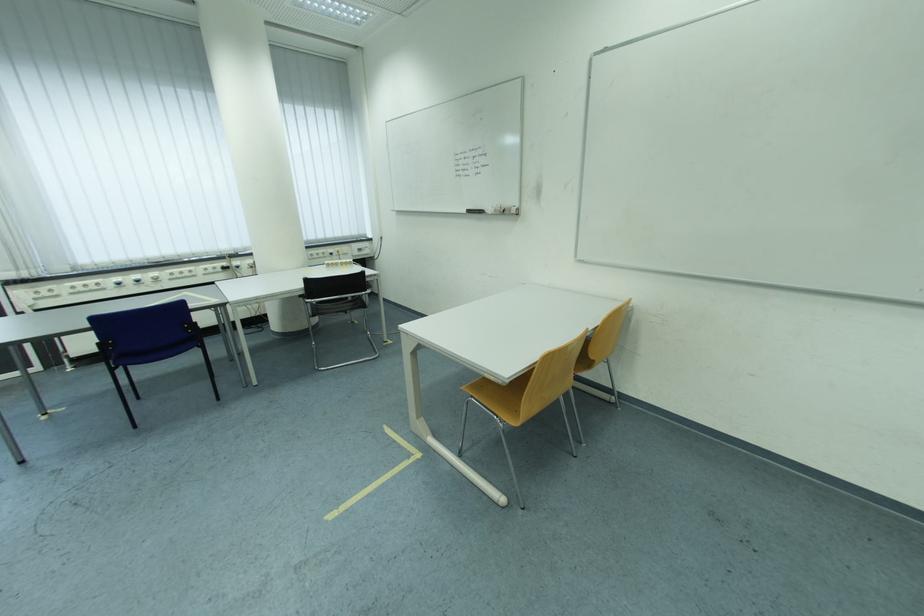
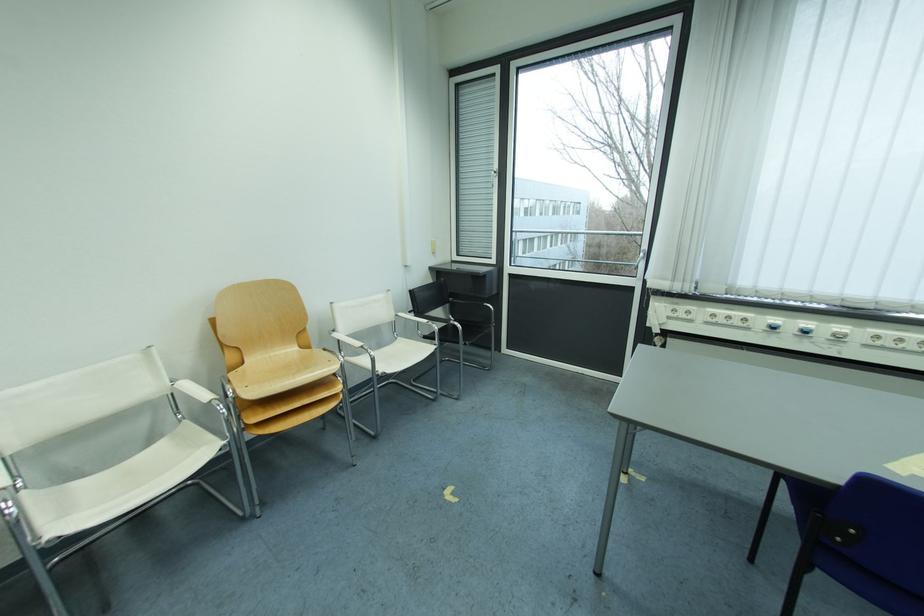
Where in the second image is the point corresponding to point 178,282 from the first image?

(874, 347)